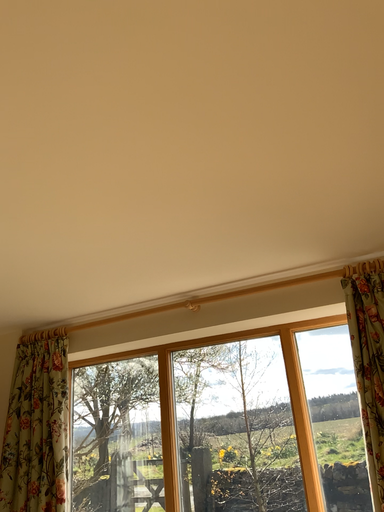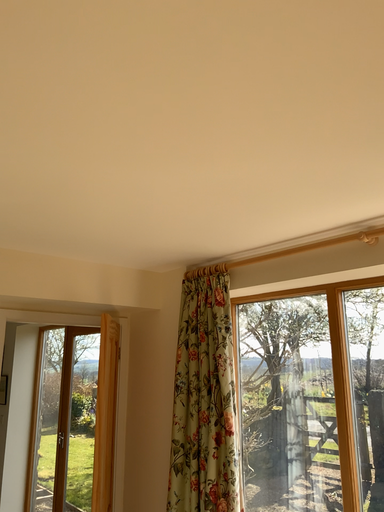
Question: Which way did the camera rotate in the video?

Choices:
 (A) rotated downward
 (B) rotated upward

Answer: (A)